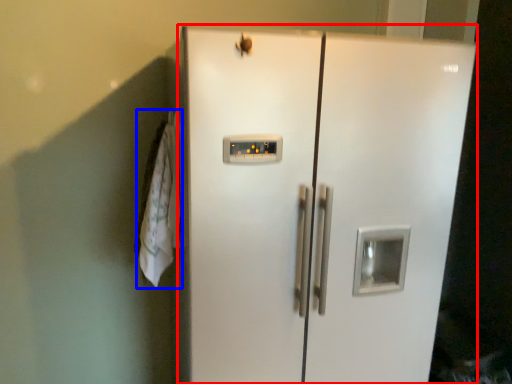
Question: Which object appears farthest to the camera in this image, refrigerator (highlighted by a red box) or laundry (highlighted by a blue box)?

Choices:
 (A) refrigerator
 (B) laundry

Answer: (B)